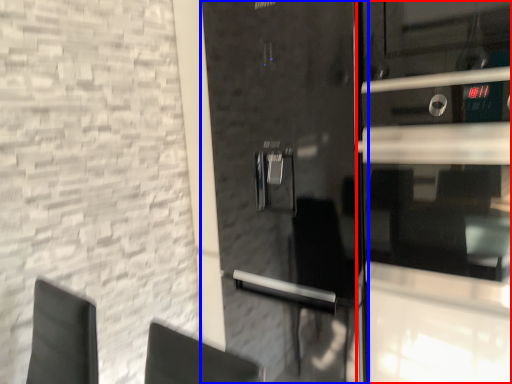
Question: Which object appears farthest to the camera in this image, glass door (highlighted by a red box) or door (highlighted by a blue box)?

Choices:
 (A) glass door
 (B) door

Answer: (B)